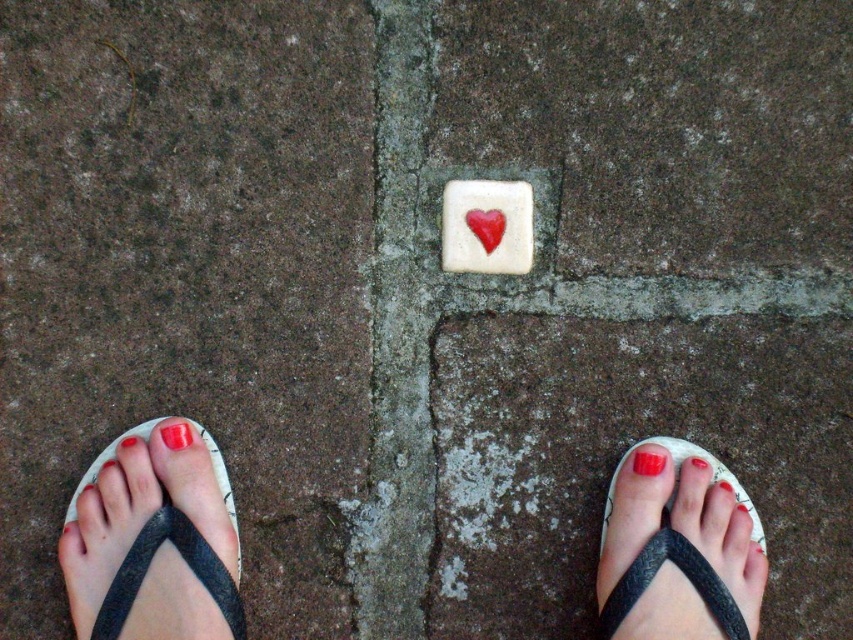
You are a person standing on the pavement and you want to step on the white matte tile with red heart at center and the glossy red nail at center. Which object is taller and requires more careful stepping?

The white matte tile with red heart at center is much taller than the glossy red nail at center, so stepping on it requires more careful attention to avoid tripping.

You are standing on the pavement and see both the white matte tile with red heart at center and the glossy red nail at center. Which object is positioned to the left when viewed from your perspective?

The white matte tile with red heart at center is positioned to the left of the glossy red nail at center.